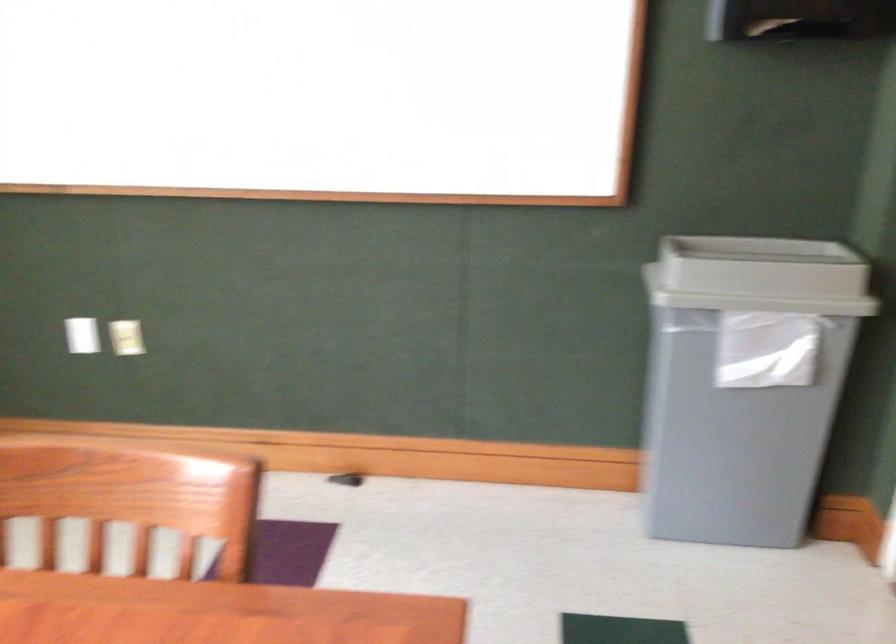
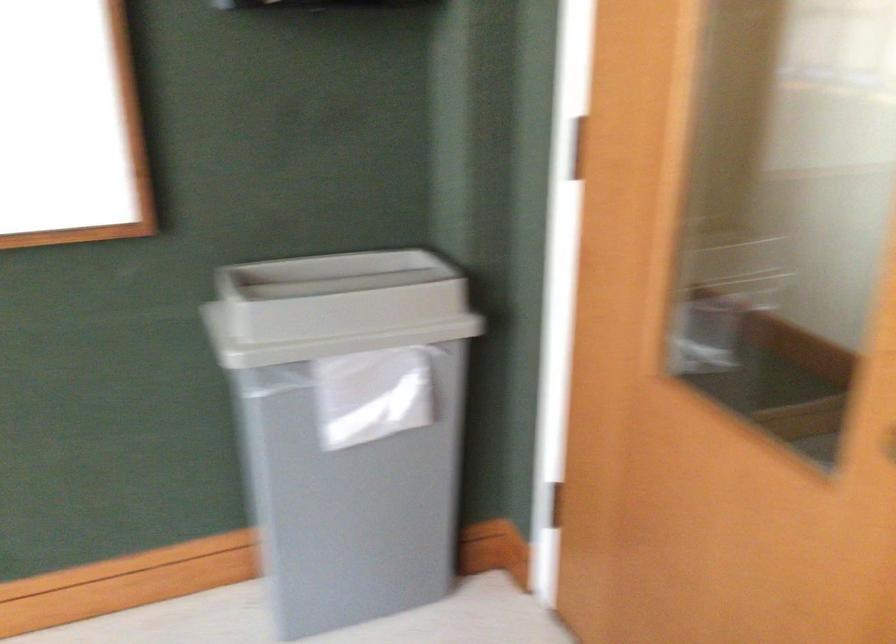
Question: How did the camera likely rotate?

Choices:
 (A) Left
 (B) Right
 (C) Up
 (D) Down

Answer: (B)